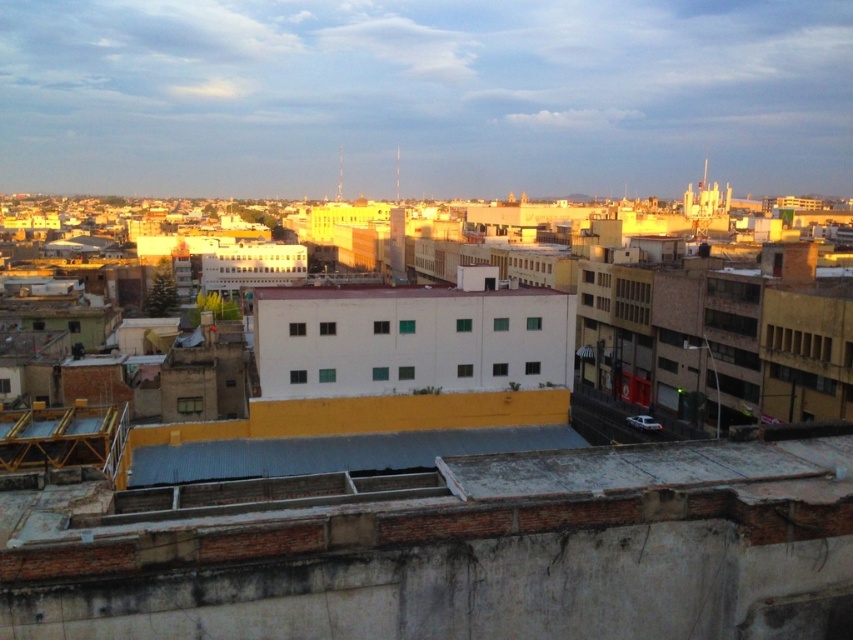
You are a delivery drone operator who needs to navigate between two gray corrugated metal roofs in an urban area. The roofs are labeled as the gray corrugated metal roof at lower right and the gray corrugated metal roof at center. According to the scene, which roof is located to the right of the other?

The gray corrugated metal roof at lower right is positioned on the right side of the gray corrugated metal roof at center.

Based on the scene description, where is the gray corrugated metal roof at lower right located in terms of its 2D coordinates?

The gray corrugated metal roof at lower right is located at coordinates point (x=654, y=465).